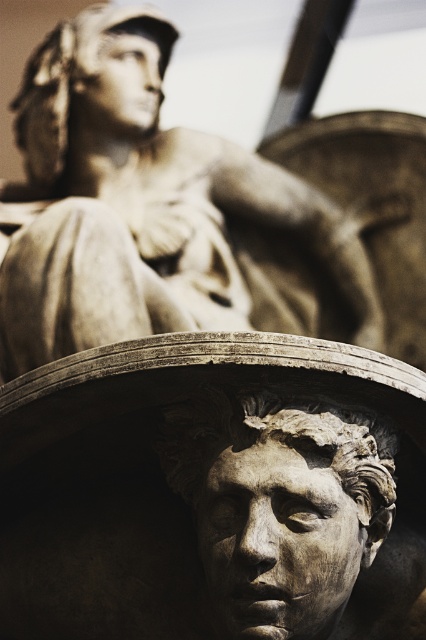
The height and width of the screenshot is (640, 426). What are the coordinates of `matte stone statue at upper left` in the screenshot? It's located at (143, 204).

How distant is matte stone statue at upper left from matte stone head at center?

matte stone statue at upper left and matte stone head at center are 19.24 meters apart.

Which is behind, point (316, 244) or point (261, 637)?

The point (316, 244) is behind.

The width and height of the screenshot is (426, 640). Identify the location of matte stone statue at upper left. (143, 204).

This screenshot has height=640, width=426. What do you see at coordinates (279, 504) in the screenshot?
I see `matte stone head at center` at bounding box center [279, 504].

Does matte stone head at center have a greater height compared to matte bronze head at upper center?

No, matte stone head at center is not taller than matte bronze head at upper center.

You are a GUI agent. You are given a task and a screenshot of the screen. Output one action in this format:
    pyautogui.click(x=<x>, y=<y>)
    Task: Click on the matte stone head at center
    This screenshot has width=426, height=640.
    Given the screenshot: What is the action you would take?
    pyautogui.click(x=279, y=504)

Where is `matte stone head at center`? The height and width of the screenshot is (640, 426). matte stone head at center is located at coordinates (279, 504).

Between matte stone statue at upper left and matte bronze head at upper center, which one is positioned higher?

matte bronze head at upper center is above.

Is matte stone statue at upper left wider than matte bronze head at upper center?

Yes, matte stone statue at upper left is wider than matte bronze head at upper center.

Who is more distant from viewer, (88,170) or (26,172)?

Point (26,172)

Locate an element on the screen. The height and width of the screenshot is (640, 426). matte stone statue at upper left is located at coordinates (143, 204).